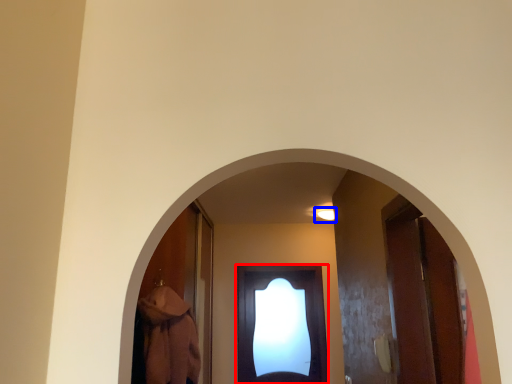
Question: Which point is closer to the camera, door (highlighted by a red box) or light (highlighted by a blue box)?

Choices:
 (A) door
 (B) light

Answer: (B)